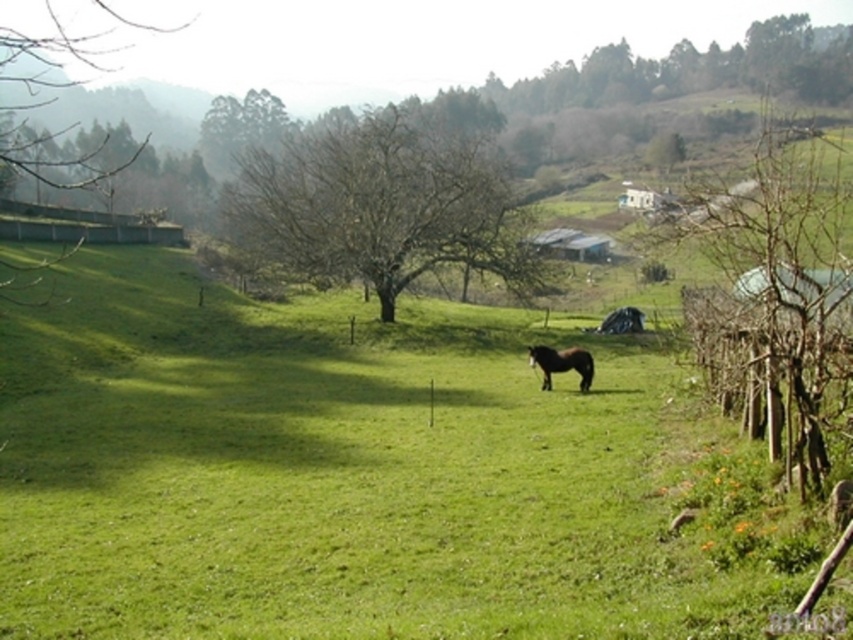
Question: Can you confirm if bare wood tree at center is positioned below brown glossy horse at center?

Choices:
 (A) no
 (B) yes

Answer: (A)

Question: Which point appears farthest from the camera in this image?

Choices:
 (A) (293, 252)
 (B) (537, 353)
 (C) (776, 346)

Answer: (A)

Question: Which point is closer to the camera taking this photo?

Choices:
 (A) (463, 244)
 (B) (782, 353)

Answer: (B)

Question: Does bare wood tree at right lie behind brown glossy horse at center?

Choices:
 (A) no
 (B) yes

Answer: (A)

Question: Among these points, which one is nearest to the camera?

Choices:
 (A) (775, 438)
 (B) (590, 358)
 (C) (381, 285)

Answer: (A)

Question: Can you confirm if bare wood tree at right is smaller than brown glossy horse at center?

Choices:
 (A) no
 (B) yes

Answer: (A)